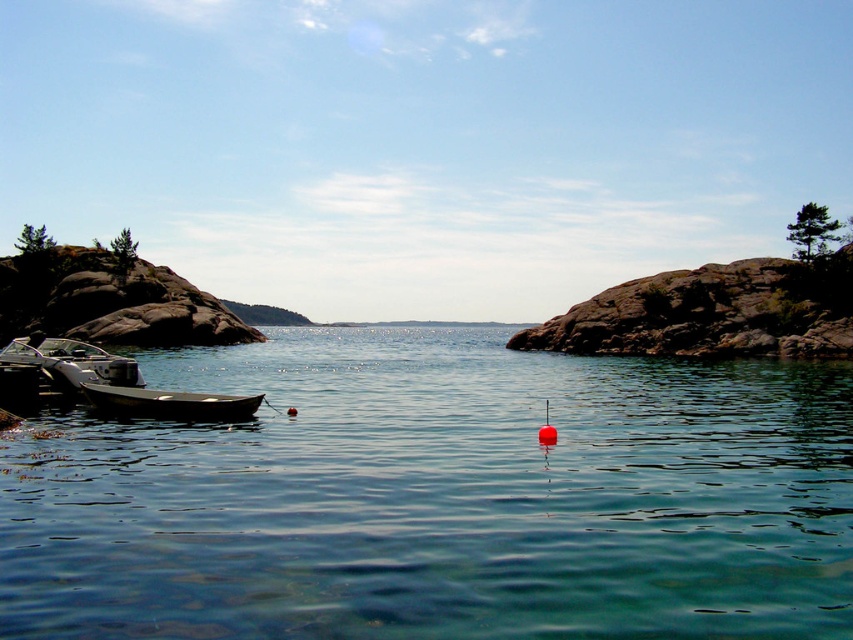
Is clear water at center shorter than smooth dark wood canoe at left?

In fact, clear water at center may be taller than smooth dark wood canoe at left.

Does point (108, 484) come in front of point (190, 404)?

Yes, it is.

What are the coordinates of `clear water at center` in the screenshot? It's located at (439, 497).

Who is positioned more to the right, metallic gray boat at left or smooth dark wood canoe at left?

Positioned to the right is smooth dark wood canoe at left.

Can you confirm if metallic gray boat at left is positioned above smooth dark wood canoe at left?

Correct, metallic gray boat at left is located above smooth dark wood canoe at left.

What do you see at coordinates (61, 369) in the screenshot? I see `metallic gray boat at left` at bounding box center [61, 369].

Identify the location of metallic gray boat at left. (61, 369).

Can you confirm if clear water at center is positioned to the left of metallic gray boat at left?

No, clear water at center is not to the left of metallic gray boat at left.

Who is taller, clear water at center or metallic gray boat at left?

metallic gray boat at left

Where is `clear water at center`? The image size is (853, 640). clear water at center is located at coordinates (439, 497).

This screenshot has height=640, width=853. I want to click on clear water at center, so click(x=439, y=497).